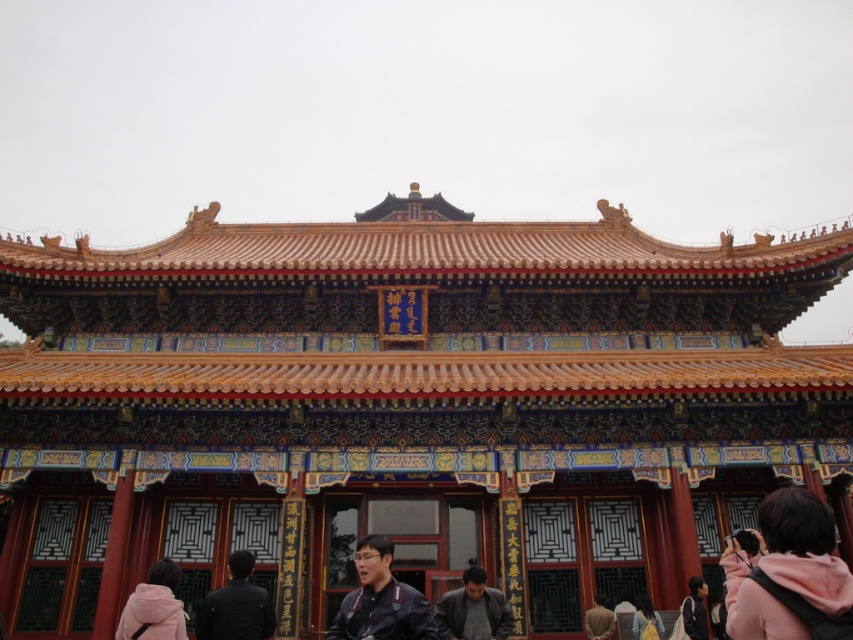
Question: Does dark gray jacket at lower center appear under yellow fabric bag at lower right?

Choices:
 (A) yes
 (B) no

Answer: (B)

Question: Estimate the real-world distances between objects in this image. Which object is farther from the brown fabric bag at lower center?

Choices:
 (A) black fabric jacket at lower center
 (B) pink fleece jacket at lower left
 (C) yellow fabric bag at lower right
 (D) leather jacket at center

Answer: (B)

Question: Is golden ornate roof at center further to camera compared to dark gray fabric jacket at lower center?

Choices:
 (A) yes
 (B) no

Answer: (B)

Question: Which object is farther from the camera taking this photo?

Choices:
 (A) brown fabric bag at lower center
 (B) black fabric jacket at lower center
 (C) yellow fabric bag at lower right

Answer: (A)

Question: Can you confirm if dark gray jacket at lower center is thinner than yellow fabric bag at lower right?

Choices:
 (A) no
 (B) yes

Answer: (A)

Question: Which object appears closest to the camera in this image?

Choices:
 (A) dark gray jacket at lower center
 (B) dark gray fabric jacket at lower center
 (C) golden ornate roof at center

Answer: (A)